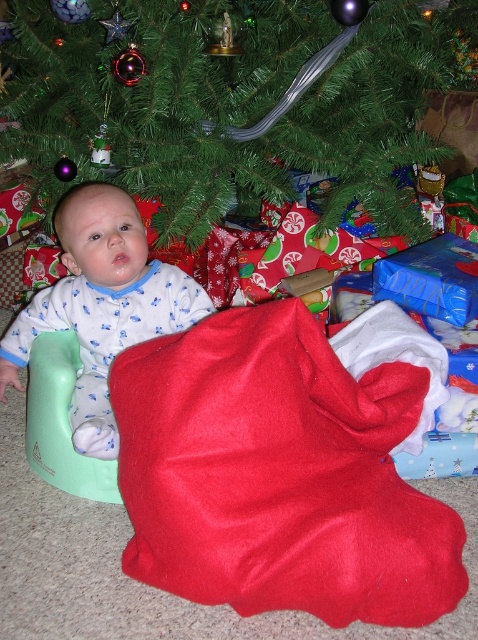
Question: Is green matte christmas tree at center closer to camera compared to metallic silver ornament at upper center?

Choices:
 (A) no
 (B) yes

Answer: (B)

Question: Which object is closer to the camera taking this photo?

Choices:
 (A) matte blue pajamas at center
 (B) green matte christmas tree at center
 (C) red felt bag at lower center
 (D) metallic silver ornament at upper center

Answer: (C)

Question: Can you confirm if green matte christmas tree at center is positioned to the right of matte blue pajamas at center?

Choices:
 (A) yes
 (B) no

Answer: (A)

Question: Considering the real-world distances, which object is closest to the metallic silver ornament at upper center?

Choices:
 (A) matte blue pajamas at center
 (B) green plastic chair at left
 (C) green matte christmas tree at center
 (D) red felt bag at lower center

Answer: (C)

Question: Considering the real-world distances, which object is farthest from the red felt bag at lower center?

Choices:
 (A) green matte christmas tree at center
 (B) green plastic chair at left
 (C) metallic silver ornament at upper center

Answer: (C)

Question: Can you confirm if red felt bag at lower center is wider than matte blue pajamas at center?

Choices:
 (A) no
 (B) yes

Answer: (B)